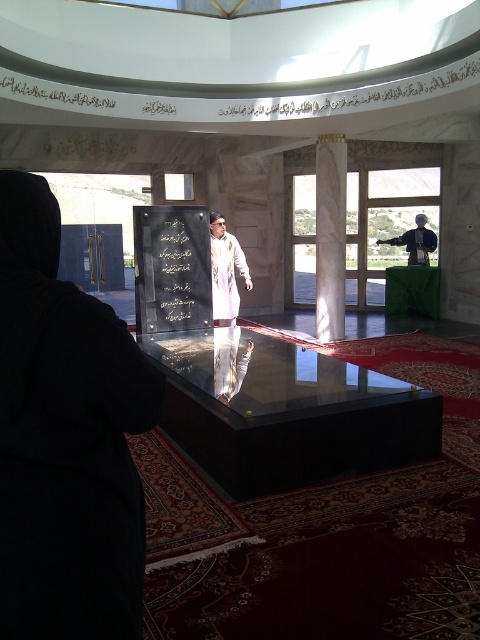
Can you confirm if white matte robe at center is smaller than dark gray fabric robe at right?

No, white matte robe at center is not smaller than dark gray fabric robe at right.

Is point (220, 276) closer to viewer compared to point (408, 230)?

Yes, point (220, 276) is in front of point (408, 230).

Locate an element on the screen. white matte robe at center is located at coordinates (227, 275).

Which of these two, black matte dress at left or white marble column at center, stands taller?

With more height is white marble column at center.

The image size is (480, 640). Describe the element at coordinates (66, 438) in the screenshot. I see `black matte dress at left` at that location.

Is point (60, 241) behind point (337, 330)?

No, (60, 241) is in front of (337, 330).

What are the coordinates of `black matte dress at left` in the screenshot? It's located at (66, 438).

In the scene shown: Can you confirm if black polished stone at center is smaller than white matte robe at center?

Yes.

Consider the image. Is black polished stone at center below white matte robe at center?

Yes, black polished stone at center is below white matte robe at center.

Where is `black polished stone at center`? The width and height of the screenshot is (480, 640). black polished stone at center is located at coordinates (175, 273).